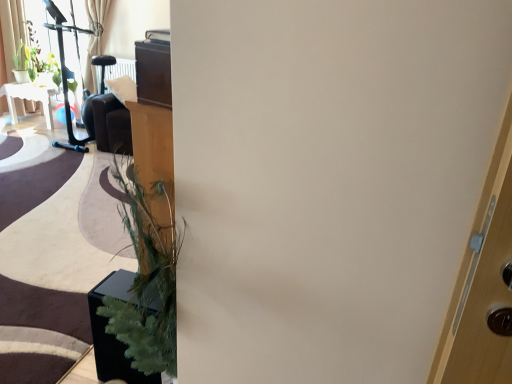
Question: From a real-world perspective, relative to white glossy table at upper left, is green matte plant at upper left, marked as the second plant in a left-to-right arrangement, vertically above or below?

Choices:
 (A) below
 (B) above

Answer: (B)

Question: Considering the positions of point (67, 77) and point (11, 99), is point (67, 77) closer or farther from the camera than point (11, 99)?

Choices:
 (A) closer
 (B) farther

Answer: (A)

Question: Which object is positioned closest to the green artificial plant at lower left?

Choices:
 (A) green matte plant at upper left, the first plant in the right-to-left sequence
 (B) light beige fabric curtain at upper left
 (C) white glossy table at upper left
 (D) green matte plant at upper left, the first plant viewed from the left

Answer: (C)

Question: Based on their relative distances, which object is nearer to the white glossy table at upper left?

Choices:
 (A) green artificial plant at lower left
 (B) green matte plant at upper left, the first plant in the right-to-left sequence
 (C) green matte plant at upper left, the first plant viewed from the left
 (D) light beige fabric curtain at upper left

Answer: (C)